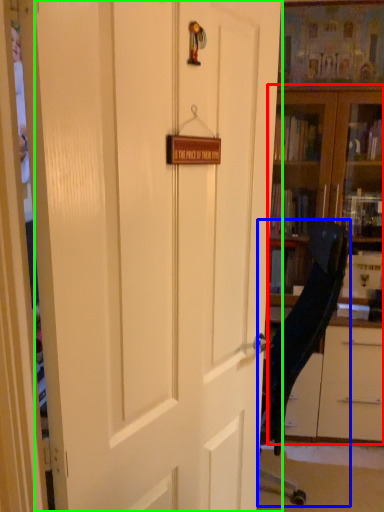
Question: Which object is positioned farthest from bookcase (highlighted by a red box)? Select from chair (highlighted by a blue box) and door (highlighted by a green box).

Choices:
 (A) chair
 (B) door

Answer: (B)